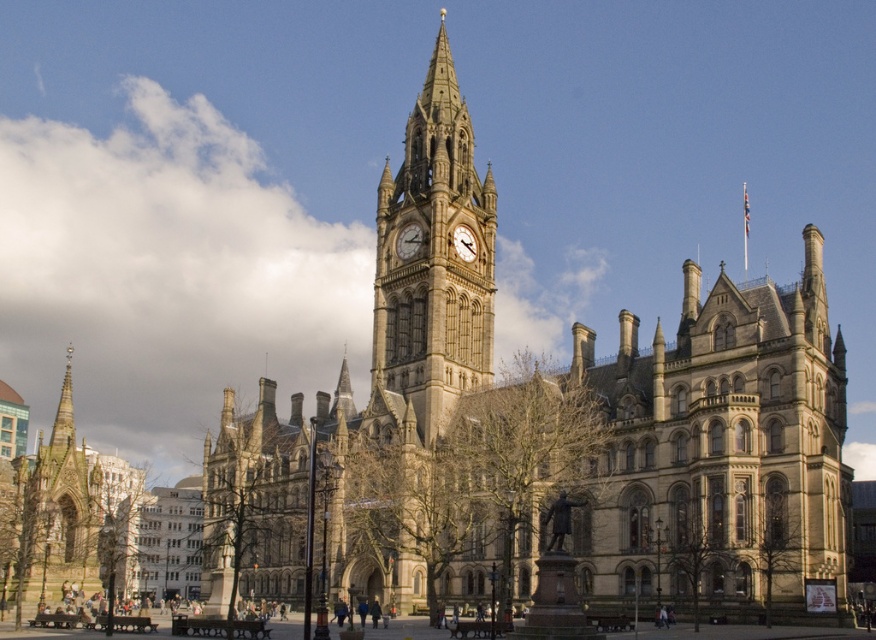
Between point (368, 595) and point (472, 259), which one is positioned in front?

Point (368, 595) is more forward.

Can you confirm if stone clock tower at center is wider than matte gray clock at center?

Yes.

Identify the location of stone clock tower at center. (578, 420).

Can you confirm if stone clock tower at center is taller than golden stone clock tower at center?

Yes.

How distant is stone clock tower at center from golden stone clock tower at center?

stone clock tower at center and golden stone clock tower at center are 6.82 meters apart.

This screenshot has width=876, height=640. What do you see at coordinates (578, 420) in the screenshot? I see `stone clock tower at center` at bounding box center [578, 420].

Locate an element on the screen. This screenshot has height=640, width=876. stone clock tower at center is located at coordinates (578, 420).

Can you confirm if golden stone clock tower at center is thinner than matte gray clock at center?

No.

The image size is (876, 640). I want to click on golden stone clock tower at center, so click(433, 260).

Between point (481, 189) and point (465, 257), which one is positioned behind?

Positioned behind is point (481, 189).

This screenshot has width=876, height=640. In order to click on golden stone clock tower at center in this screenshot , I will do `click(433, 260)`.